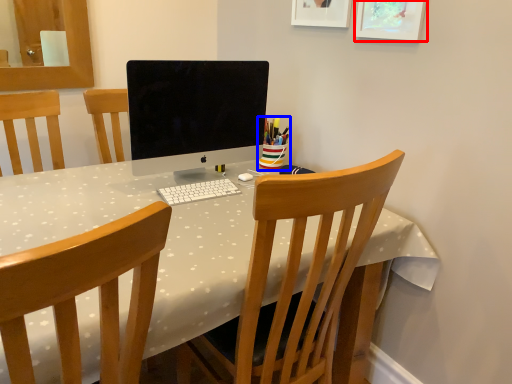
Question: Which of the following is the farthest to the observer, picture frame (highlighted by a red box) or stationery (highlighted by a blue box)?

Choices:
 (A) picture frame
 (B) stationery

Answer: (B)